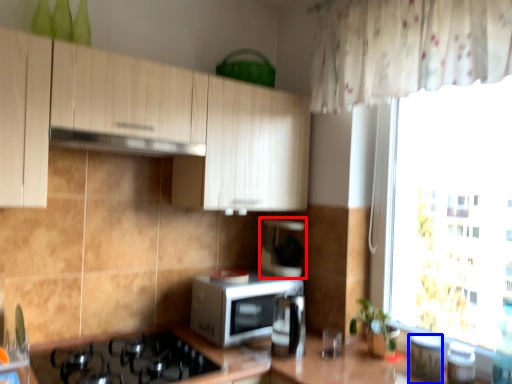
Question: Which object is closer to the camera taking this photo, coffee machine (highlighted by a red box) or appliance (highlighted by a blue box)?

Choices:
 (A) coffee machine
 (B) appliance

Answer: (B)